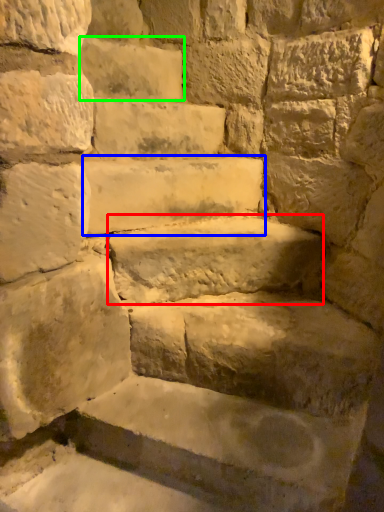
Question: Which is nearer to the brick (highlighted by a red box)? stone (highlighted by a blue box) or brick (highlighted by a green box).

Choices:
 (A) stone
 (B) brick

Answer: (A)